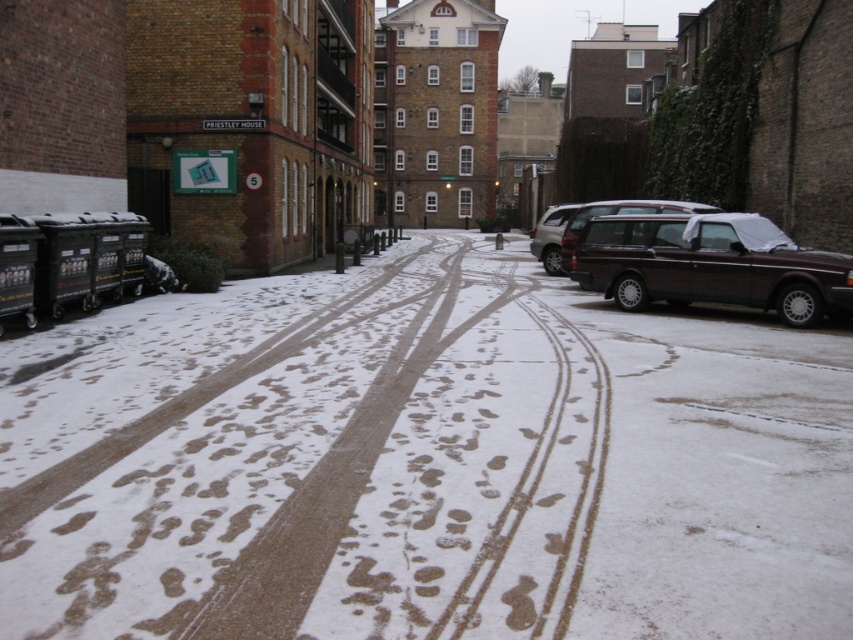
In the scene shown: Between white snow at center and dark brown matte suv at right, which one appears on the right side from the viewer's perspective?

dark brown matte suv at right

Between white snow at center and dark brown matte suv at right, which one appears on the left side from the viewer's perspective?

white snow at center

Locate an element on the screen. The width and height of the screenshot is (853, 640). white snow at center is located at coordinates (424, 461).

Does point (194, 381) come farther from viewer compared to point (666, 236)?

No, (194, 381) is closer to viewer.

Between white snow at center and maroon metallic station wagon at right, which one has more height?

Standing taller between the two is maroon metallic station wagon at right.

Find the location of a particular element. white snow at center is located at coordinates (424, 461).

You are a GUI agent. You are given a task and a screenshot of the screen. Output one action in this format:
    pyautogui.click(x=<x>, y=<y>)
    Task: Click on the white snow at center
    The image size is (853, 640).
    Given the screenshot: What is the action you would take?
    pyautogui.click(x=424, y=461)

Does maroon metallic station wagon at right appear under dark brown matte suv at right?

Correct, maroon metallic station wagon at right is located below dark brown matte suv at right.

Does maroon metallic station wagon at right lie in front of dark brown matte suv at right?

Yes, it is.

At what (x,y) coordinates should I click in order to perform the action: click on maroon metallic station wagon at right. Please return your answer as a coordinate pair (x, y). Looking at the image, I should click on (711, 266).

You are a GUI agent. You are given a task and a screenshot of the screen. Output one action in this format:
    pyautogui.click(x=<x>, y=<y>)
    Task: Click on the maroon metallic station wagon at right
    The image size is (853, 640).
    Given the screenshot: What is the action you would take?
    pyautogui.click(x=711, y=266)